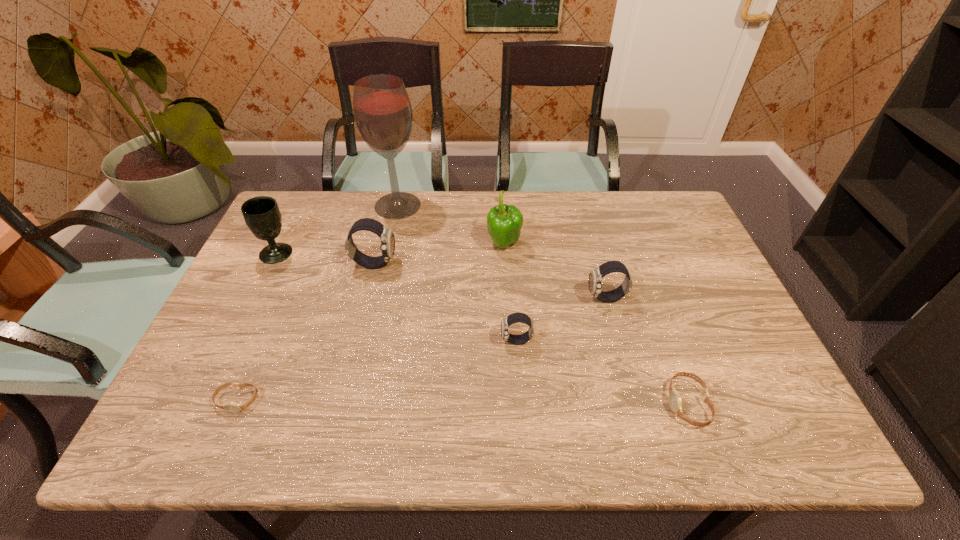
Locate an element on the screen. Image resolution: width=960 pixels, height=540 pixels. empty space between the third tallest watch and the tallest object is located at coordinates (457, 273).

At what (x,y) coordinates should I click in order to perform the action: click on vacant area that lies between the second watch from right to left and the chalice. Please return your answer as a coordinate pair (x, y). The width and height of the screenshot is (960, 540). Looking at the image, I should click on (442, 276).

You are a GUI agent. You are given a task and a screenshot of the screen. Output one action in this format:
    pyautogui.click(x=<x>, y=<y>)
    Task: Click on the free spot between the chalice and the fifth farthest object
    
    Given the screenshot: What is the action you would take?
    pyautogui.click(x=442, y=276)

Locate an element on the screen. Image resolution: width=960 pixels, height=540 pixels. blank region between the bigger beige watch and the chalice is located at coordinates (482, 328).

The width and height of the screenshot is (960, 540). What are the coordinates of `vacant point located between the red alcohol and the left beige watch` in the screenshot? It's located at (318, 303).

The width and height of the screenshot is (960, 540). In order to click on vacant region between the chalice and the second watch from right to left in this screenshot , I will do `click(442, 276)`.

Identify the location of empty location between the second object from right to left and the shortest object. The image size is (960, 540). (421, 349).

Identify which object is the second nearest to the chalice. Please provide its 2D coordinates. Your answer should be formatted as a tuple, i.e. [(x, y)], where the tuple contains the x and y coordinates of a point satisfying the conditions above.

[(383, 114)]

Locate an element on the screen. object that is the fourth closest to the biggest dark watch is located at coordinates (513, 318).

Identify which watch is the fifth nearest to the bell pepper. Please provide its 2D coordinates. Your answer should be formatted as a tuple, i.e. [(x, y)], where the tuple contains the x and y coordinates of a point satisfying the conditions above.

[(233, 407)]